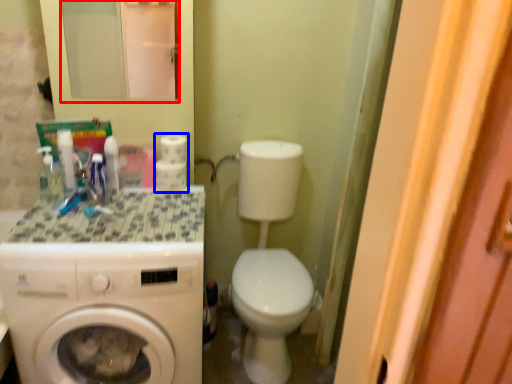
Question: Which object is further to the camera taking this photo, mirror (highlighted by a red box) or toilet paper (highlighted by a blue box)?

Choices:
 (A) mirror
 (B) toilet paper

Answer: (B)